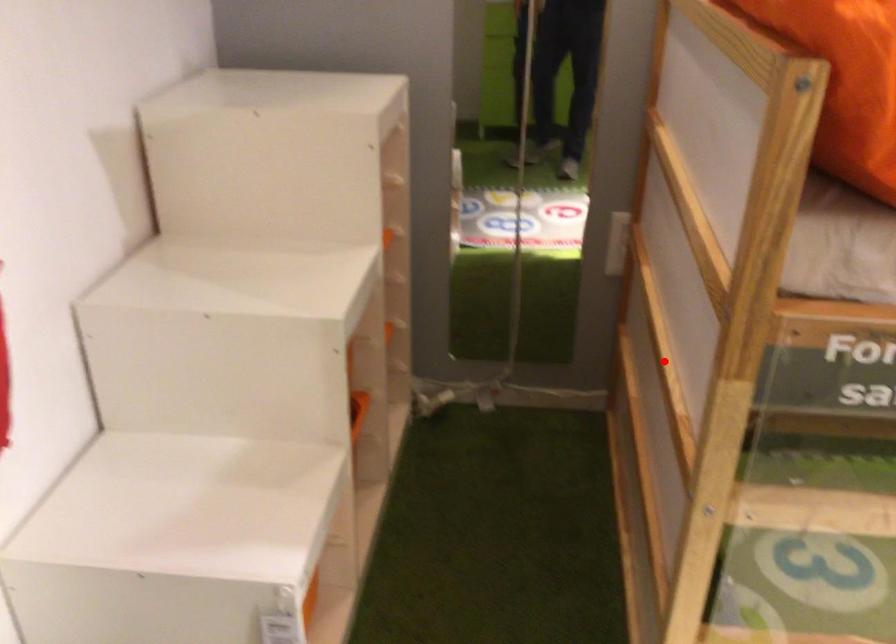
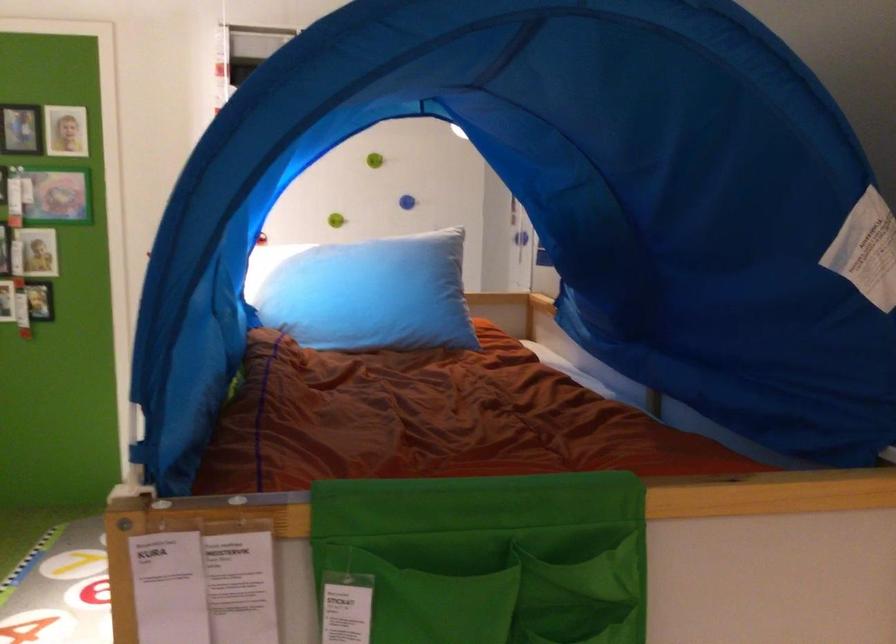
Question: I am providing you with two images of the same scene from different viewpoints. A red point is marked on the first image. At the location where the point appears in image 1, is it still visible in image 2?

Choices:
 (A) Yes
 (B) No

Answer: (B)